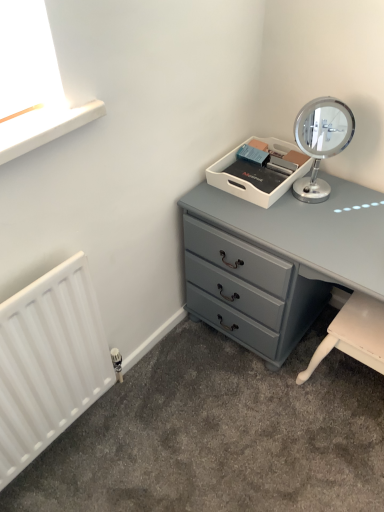
This screenshot has width=384, height=512. Find the location of `free space above matte gray chest of drawers at center (from a real-world perspective)`. free space above matte gray chest of drawers at center (from a real-world perspective) is located at coordinates pos(326,218).